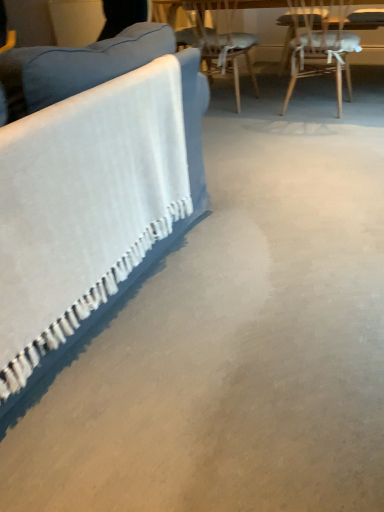
Question: From a real-world perspective, does wooden chair at upper right, arranged as the 1th chair when viewed from the left, stand above wooden chair at upper right, placed as the first chair when sorted from right to left?

Choices:
 (A) no
 (B) yes

Answer: (B)

Question: Can you confirm if wooden chair at upper right, which is the second chair in right-to-left order, is shorter than wooden chair at upper right, placed as the first chair when sorted from right to left?

Choices:
 (A) no
 (B) yes

Answer: (A)

Question: Does wooden chair at upper right, which is the second chair in right-to-left order, have a smaller size compared to wooden chair at upper right, which ranks as the 2th chair in left-to-right order?

Choices:
 (A) yes
 (B) no

Answer: (A)

Question: From the image's perspective, is wooden chair at upper right, which is the second chair in right-to-left order, over wooden chair at upper right, which ranks as the 2th chair in left-to-right order?

Choices:
 (A) yes
 (B) no

Answer: (A)

Question: Considering the relative positions of wooden chair at upper right, arranged as the 1th chair when viewed from the left, and wooden chair at upper right, which ranks as the 2th chair in left-to-right order, in the image provided, is wooden chair at upper right, arranged as the 1th chair when viewed from the left, to the left of wooden chair at upper right, which ranks as the 2th chair in left-to-right order, from the viewer's perspective?

Choices:
 (A) no
 (B) yes

Answer: (B)

Question: Is wooden chair at upper right, arranged as the 1th chair when viewed from the left, looking in the opposite direction of wooden chair at upper right, placed as the first chair when sorted from right to left?

Choices:
 (A) no
 (B) yes

Answer: (A)

Question: Is blue fabric couch at left at the right side of wooden chair at upper right, placed as the first chair when sorted from right to left?

Choices:
 (A) no
 (B) yes

Answer: (A)

Question: Can we say blue fabric couch at left lies outside wooden chair at upper right, placed as the first chair when sorted from right to left?

Choices:
 (A) no
 (B) yes

Answer: (B)

Question: Are blue fabric couch at left and wooden chair at upper right, which ranks as the 2th chair in left-to-right order, beside each other?

Choices:
 (A) no
 (B) yes

Answer: (A)

Question: Is blue fabric couch at left shorter than wooden chair at upper right, which ranks as the 2th chair in left-to-right order?

Choices:
 (A) yes
 (B) no

Answer: (B)

Question: Does blue fabric couch at left have a larger size compared to wooden chair at upper right, which ranks as the 2th chair in left-to-right order?

Choices:
 (A) no
 (B) yes

Answer: (B)

Question: Is blue fabric couch at left smaller than wooden chair at upper right, placed as the first chair when sorted from right to left?

Choices:
 (A) no
 (B) yes

Answer: (A)

Question: Are blue fabric couch at left and wooden chair at upper right, arranged as the 1th chair when viewed from the left, beside each other?

Choices:
 (A) no
 (B) yes

Answer: (A)